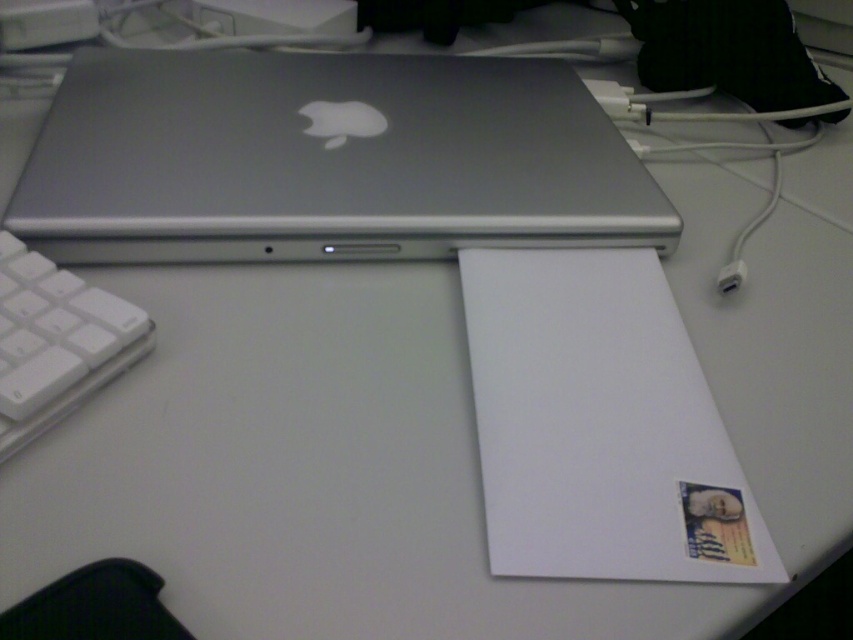
Question: Where is white plastic keyboard at lower left located in relation to white plastic plug at lower right in the image?

Choices:
 (A) below
 (B) above

Answer: (A)

Question: Which object appears closest to the camera in this image?

Choices:
 (A) white plastic plug at lower right
 (B) satin silver laptop at upper center

Answer: (B)

Question: Which object is farther from the camera taking this photo?

Choices:
 (A) white plastic keyboard at lower left
 (B) white plastic plug at lower right
 (C) satin silver laptop at upper center

Answer: (B)

Question: Can you confirm if satin silver laptop at upper center is positioned to the left of white plastic plug at lower right?

Choices:
 (A) no
 (B) yes

Answer: (B)

Question: Estimate the real-world distances between objects in this image. Which object is closer to the white plastic plug at lower right?

Choices:
 (A) white plastic keyboard at lower left
 (B) satin silver laptop at upper center

Answer: (B)

Question: Can you confirm if white plastic keyboard at lower left is smaller than white plastic plug at lower right?

Choices:
 (A) yes
 (B) no

Answer: (B)